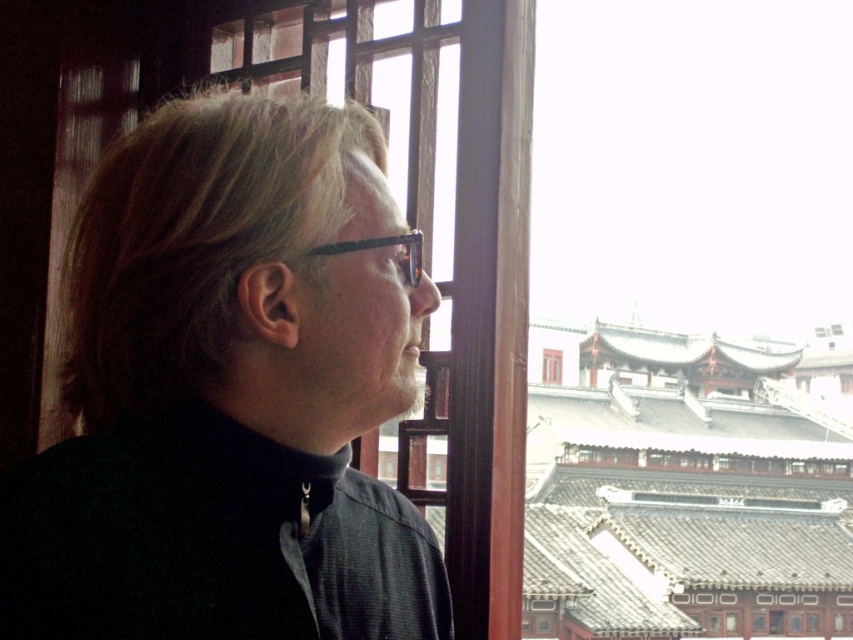
You are a photographer trying to capture the person in the scene. You need to focus on the black matte jacket at center and the transparent plastic glasses at center. Which object should you adjust your camera focus on first if you want to ensure both are in focus, given their positions?

The transparent plastic glasses at center should be focused on first because the black matte jacket at center is to the right of transparent plastic glasses at center, so adjusting focus starting from the glasses ensures the jacket is within the depth of field.

You are standing in front of the window and see two points marked on the window frame. The first point is at coordinate point [321,497] and the second point is at coordinate point [331,250]. Which point is closer to you?

Point [331,250] is closer to you because it is less further to the camera than point [321,497].